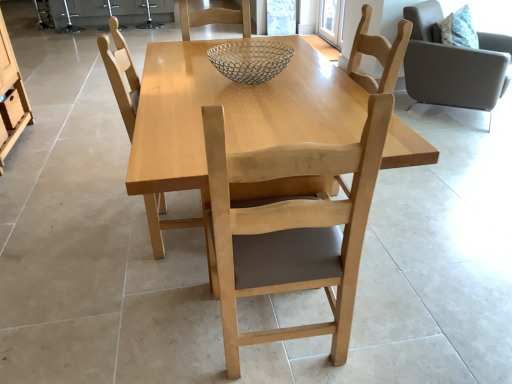
Measure the distance between point (223,63) and camera.

The distance of point (223,63) from camera is 5.93 feet.

Based on the photo, measure the distance between metallic wire mesh bowl at center and camera.

metallic wire mesh bowl at center and camera are 5.74 feet apart.

What do you see at coordinates (229, 118) in the screenshot?
I see `light wood table at center` at bounding box center [229, 118].

Find the location of a particular element. This screenshot has width=512, height=384. light wood chair at center, arranged as the first chair when viewed from the left is located at coordinates (121, 77).

Describe the element at coordinates (331, 21) in the screenshot. I see `transparent glass window screen at upper center` at that location.

I want to click on light brown wood chair at right, which appears as the first chair when viewed from the back, so click(x=453, y=64).

You are a GUI agent. You are given a task and a screenshot of the screen. Output one action in this format:
    pyautogui.click(x=<x>, y=<y>)
    Task: Click on the metallic wire mesh bowl at center
    The image size is (512, 384).
    Given the screenshot: What is the action you would take?
    pyautogui.click(x=250, y=60)

Based on the photo, is light wood chair at center, which is the second chair in right-to-left order, wider or thinner than light brown wood chair at right, placed as the 3th chair when sorted from left to right?

In the image, light wood chair at center, which is the second chair in right-to-left order, appears to be more narrow than light brown wood chair at right, placed as the 3th chair when sorted from left to right.

Are light wood chair at center, the 2th chair when ordered from left to right, and light brown wood chair at right, which is the 3th chair in front-to-back order, far apart?

light wood chair at center, the 2th chair when ordered from left to right, is positioned a significant distance from light brown wood chair at right, which is the 3th chair in front-to-back order.

Between light wood chair at center, placed as the 3th chair when sorted from back to front, and light brown wood chair at right, which appears as the first chair when viewed from the back, which one has smaller size?

Smaller between the two is light wood chair at center, placed as the 3th chair when sorted from back to front.

What's the angular difference between light wood chair at center, placed as the 3th chair when sorted from back to front, and light brown wood chair at right, which appears as the first chair when viewed from the back,'s facing directions?

141 degrees separate the facing orientations of light wood chair at center, placed as the 3th chair when sorted from back to front, and light brown wood chair at right, which appears as the first chair when viewed from the back.

Are light wood chair at center, the 2th chair positioned from the back, and light wood table at center beside each other?

They are not placed beside each other.

Considering the relative sizes of light wood chair at center, which is counted as the second chair, starting from the front, and light wood table at center in the image provided, is light wood chair at center, which is counted as the second chair, starting from the front, smaller than light wood table at center?

Yes, light wood chair at center, which is counted as the second chair, starting from the front, is smaller than light wood table at center.

At what (x,y) coordinates should I click in order to perform the action: click on kitchen & dining room table below the light wood chair at center, the 2th chair positioned from the back (from the image's perspective). Please return your answer as a coordinate pair (x, y). Looking at the image, I should click on (229, 118).

From the image's perspective, which is above, light wood chair at center, placed as the third chair when sorted from right to left, or light wood table at center?

From the image's view, light wood chair at center, placed as the third chair when sorted from right to left, is above.

Is matte wood drawer at left oriented away from light brown wood chair at right, which appears as the first chair when viewed from the back?

No, matte wood drawer at left's orientation is not away from light brown wood chair at right, which appears as the first chair when viewed from the back.

Considering the sizes of matte wood drawer at left and light brown wood chair at right, placed as the 3th chair when sorted from left to right, in the image, is matte wood drawer at left wider or thinner than light brown wood chair at right, placed as the 3th chair when sorted from left to right,?

Considering their sizes, matte wood drawer at left looks slimmer than light brown wood chair at right, placed as the 3th chair when sorted from left to right.

Does matte wood drawer at left have a smaller size compared to light brown wood chair at right, placed as the 3th chair when sorted from left to right?

Correct, matte wood drawer at left occupies less space than light brown wood chair at right, placed as the 3th chair when sorted from left to right.

You are a GUI agent. You are given a task and a screenshot of the screen. Output one action in this format:
    pyautogui.click(x=<x>, y=<y>)
    Task: Click on the drawer below the light brown wood chair at right, placed as the 3th chair when sorted from left to right (from the image's perspective)
    
    Given the screenshot: What is the action you would take?
    pyautogui.click(x=11, y=109)

From the image's perspective, is metallic wire mesh bowl at center located above or below light wood table at center?

Clearly, from the image's perspective, metallic wire mesh bowl at center is above light wood table at center.

In the image, is metallic wire mesh bowl at center positioned in front of or behind light wood table at center?

Visually, metallic wire mesh bowl at center is located behind light wood table at center.

Can you confirm if metallic wire mesh bowl at center is shorter than light wood table at center?

Indeed, metallic wire mesh bowl at center has a lesser height compared to light wood table at center.

Consider the image. Which of these two, metallic wire mesh bowl at center or light wood table at center, is bigger?

Bigger between the two is light wood table at center.

This screenshot has width=512, height=384. Find the location of `window screen located above the light wood chair at center, which is the second chair in right-to-left order (from the image's perspective)`. window screen located above the light wood chair at center, which is the second chair in right-to-left order (from the image's perspective) is located at coordinates (331, 21).

Considering the points (228, 237) and (329, 25), which point is behind, point (228, 237) or point (329, 25)?

The point (329, 25) is more distant.

In terms of size, does light wood chair at center, the 2th chair when ordered from left to right, appear bigger or smaller than transparent glass window screen at upper center?

In the image, light wood chair at center, the 2th chair when ordered from left to right, appears to be larger than transparent glass window screen at upper center.

Between light wood table at center and light wood chair at center, which is the 1th chair in front-to-back order, which one has larger size?

Bigger between the two is light wood table at center.

From the picture: From a real-world perspective, relative to light wood chair at center, which is the 1th chair in front-to-back order, is light wood table at center vertically above or below?

From a real-world perspective, light wood table at center is physically below light wood chair at center, which is the 1th chair in front-to-back order.

Is matte wood drawer at left completely or partially inside light brown wood chair at right, which appears as the first chair when viewed from the back?

No, light brown wood chair at right, which appears as the first chair when viewed from the back, does not contain matte wood drawer at left.

Does light brown wood chair at right, placed as the 3th chair when sorted from left to right, turn towards matte wood drawer at left?

No, light brown wood chair at right, placed as the 3th chair when sorted from left to right, does not turn towards matte wood drawer at left.

From a real-world perspective, which is physically below, light brown wood chair at right, which appears as the first chair when viewed from the back, or matte wood drawer at left?

From a 3D spatial view, matte wood drawer at left is below.

Considering the sizes of objects light brown wood chair at right, which appears as the first chair when viewed from the back, and matte wood drawer at left in the image provided, who is shorter, light brown wood chair at right, which appears as the first chair when viewed from the back, or matte wood drawer at left?

With less height is matte wood drawer at left.

Locate an element on the screen. This screenshot has width=512, height=384. chair below the light wood chair at center, the 2th chair when ordered from left to right (from a real-world perspective) is located at coordinates (453, 64).

The height and width of the screenshot is (384, 512). What are the coordinates of `kitchen & dining room table on the right of light wood chair at center, the 2th chair positioned from the back` in the screenshot? It's located at (229, 118).

From the image, which object appears to be nearer to matte wood drawer at left, light wood chair at center, the 2th chair when ordered from left to right, or light wood chair at center, arranged as the first chair when viewed from the left?

light wood chair at center, arranged as the first chair when viewed from the left, is closer to matte wood drawer at left.

Estimate the real-world distances between objects in this image. Which object is further from light wood chair at center, the 2th chair when ordered from left to right, light brown wood chair at right, which is the 3th chair in front-to-back order, or light wood chair at center, arranged as the first chair when viewed from the left?

light brown wood chair at right, which is the 3th chair in front-to-back order, is further to light wood chair at center, the 2th chair when ordered from left to right.

From the image, which object appears to be nearer to transparent glass window screen at upper center, light wood chair at center, arranged as the first chair when viewed from the left, or matte wood drawer at left?

The object closer to transparent glass window screen at upper center is light wood chair at center, arranged as the first chair when viewed from the left.

Looking at the image, which one is located further to light wood table at center, light wood chair at center, which is the 1th chair in front-to-back order, or matte wood drawer at left?

matte wood drawer at left is positioned further to the anchor light wood table at center.

Which object lies nearer to the anchor point light wood table at center, metallic wire mesh bowl at center or light wood chair at center, which is the 1th chair in front-to-back order?

Among the two, metallic wire mesh bowl at center is located nearer to light wood table at center.

Estimate the real-world distances between objects in this image. Which object is closer to light wood chair at center, which is the second chair in right-to-left order, light wood chair at center, the 2th chair positioned from the back, or light wood table at center?

light wood table at center is closer to light wood chair at center, which is the second chair in right-to-left order.

Considering their positions, is light wood chair at center, placed as the 3th chair when sorted from back to front, positioned further to light wood chair at center, which is counted as the second chair, starting from the front, than metallic wire mesh bowl at center?

Based on the image, light wood chair at center, placed as the 3th chair when sorted from back to front, appears to be further to light wood chair at center, which is counted as the second chair, starting from the front.

Considering their positions, is matte wood drawer at left positioned further to light brown wood chair at right, which appears as the first chair when viewed from the back, than light wood chair at center, the 2th chair positioned from the back?

Among the two, matte wood drawer at left is located further to light brown wood chair at right, which appears as the first chair when viewed from the back.

Where is `kitchen & dining room table located between light wood chair at center, which is the 1th chair in front-to-back order, and light wood chair at center, the 2th chair positioned from the back, in the depth direction`? kitchen & dining room table located between light wood chair at center, which is the 1th chair in front-to-back order, and light wood chair at center, the 2th chair positioned from the back, in the depth direction is located at coordinates (229, 118).

The width and height of the screenshot is (512, 384). I want to click on kitchen & dining room table situated between matte wood drawer at left and light brown wood chair at right, placed as the 3th chair when sorted from left to right, from left to right, so click(229, 118).

Where is `kitchen & dining room table between light wood chair at center, the 2th chair when ordered from left to right, and matte wood drawer at left in the front-back direction`? kitchen & dining room table between light wood chair at center, the 2th chair when ordered from left to right, and matte wood drawer at left in the front-back direction is located at coordinates (229, 118).

This screenshot has height=384, width=512. I want to click on glass bowl between matte wood drawer at left and light brown wood chair at right, which is the 3th chair in front-to-back order, from left to right, so click(x=250, y=60).